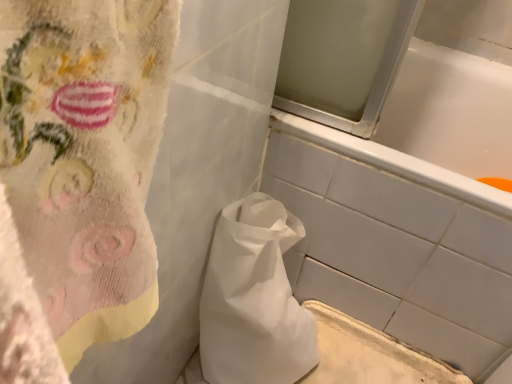
Question: Do you think white matte bathtub at center is within white paper bag at center, or outside of it?

Choices:
 (A) inside
 (B) outside

Answer: (B)

Question: From a real-world perspective, is white matte bathtub at center physically located above or below white paper bag at center?

Choices:
 (A) below
 (B) above

Answer: (B)

Question: Is point (466, 273) closer or farther from the camera than point (224, 233)?

Choices:
 (A) closer
 (B) farther

Answer: (B)

Question: From the image's perspective, is white paper bag at center above or below white matte bathtub at center?

Choices:
 (A) below
 (B) above

Answer: (A)

Question: From their relative heights in the image, would you say white paper bag at center is taller or shorter than white matte bathtub at center?

Choices:
 (A) short
 (B) tall

Answer: (A)

Question: Is point (287, 357) positioned closer to the camera than point (468, 337)?

Choices:
 (A) closer
 (B) farther

Answer: (A)

Question: In the image, is white paper bag at center positioned in front of or behind white matte bathtub at center?

Choices:
 (A) front
 (B) behind

Answer: (A)